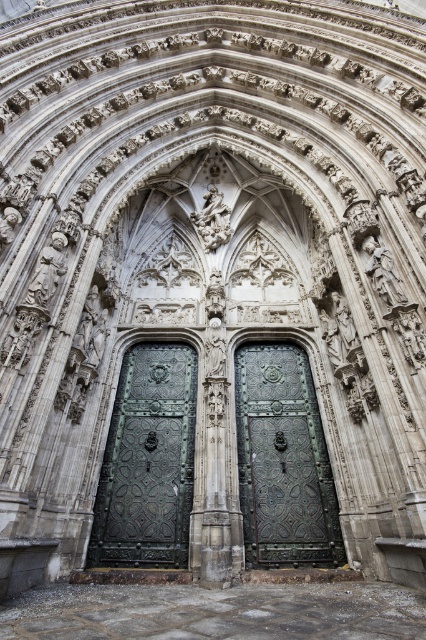
Question: Which of the following is the closest to the observer?

Choices:
 (A) (278, 429)
 (B) (189, 387)

Answer: (A)

Question: Is bronze textured door at center bigger than bronze ornate door at center?

Choices:
 (A) yes
 (B) no

Answer: (A)

Question: Which of the following is the closest to the observer?

Choices:
 (A) bronze ornate door at center
 (B) bronze textured door at center

Answer: (A)

Question: Is bronze textured door at center further to the viewer compared to bronze ornate door at center?

Choices:
 (A) no
 (B) yes

Answer: (B)

Question: Does bronze textured door at center have a larger size compared to bronze ornate door at center?

Choices:
 (A) no
 (B) yes

Answer: (B)